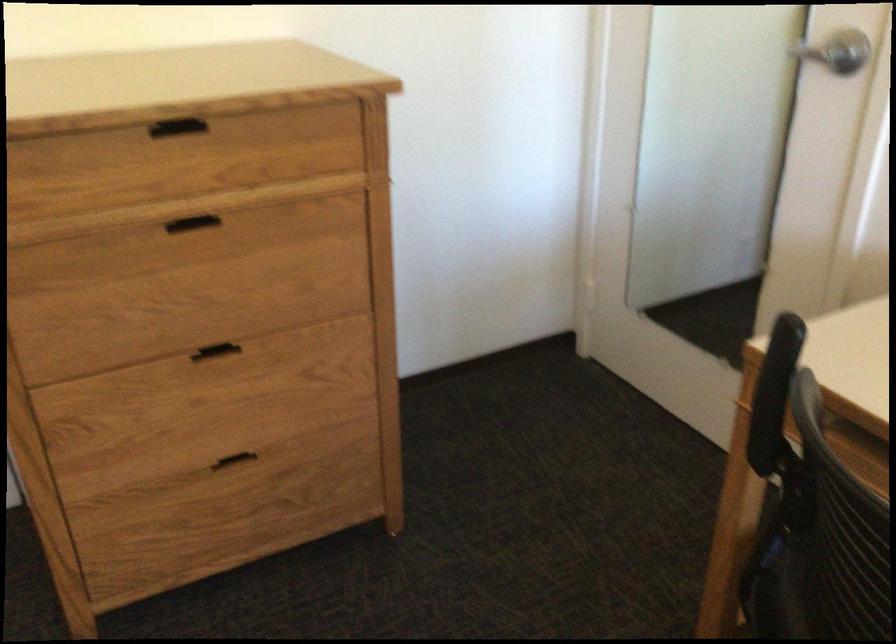
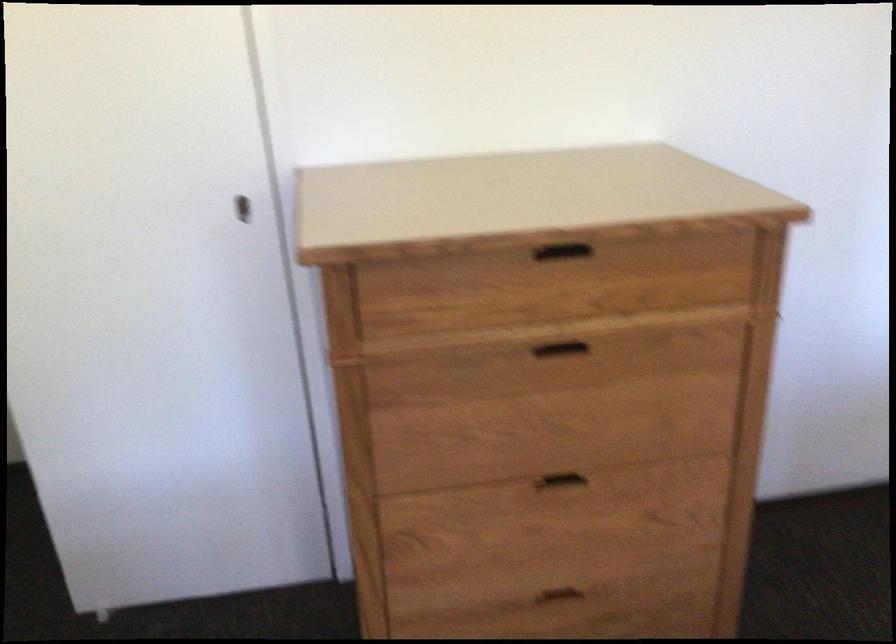
Question: The camera is either moving clockwise (left) or counter-clockwise (right) around the object. The first image is from the beginning of the video and the second image is from the end. Is the camera moving left or right when shooting the video?

Choices:
 (A) Left
 (B) Right

Answer: (B)